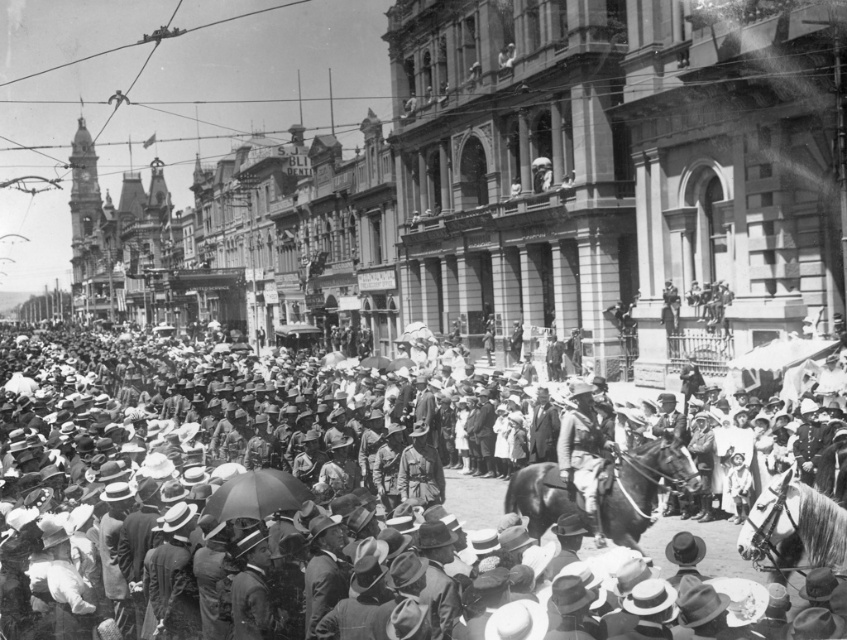
In the historical street scene, there is a shiny brown horse at center. Based on the coordinates point (641, 488), can you determine if the horse is located in the lower half or upper half of the image?

The shiny brown horse at center is located at point (641, 488), which falls within the lower half of the image since the y coordinate is 0.759, which is below the midpoint of 0.5.

You are a photographer standing at the edge of the street. You notice the matte black crowd at center and the shiny brown horse at center. Which object is taller when viewed from your position?

The matte black crowd at center is taller than the shiny brown horse at center.

You are a photographer standing at the edge of the crowd in the image. You want to take a picture of the shiny brown horse at center. Where should you position yourself to ensure the horse is in the center of your frame?

To center the shiny brown horse at center in your frame, position yourself directly in line with its coordinates at point (641, 488), ensuring the horse is at the visual center of your shot.